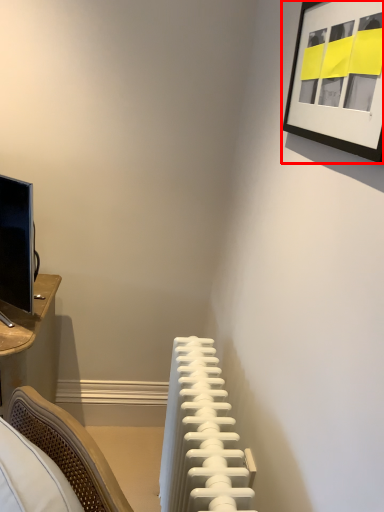
Question: From the image's perspective, what is the correct spatial relationship of picture frame (annotated by the red box) in relation to radiator?

Choices:
 (A) below
 (B) above

Answer: (B)